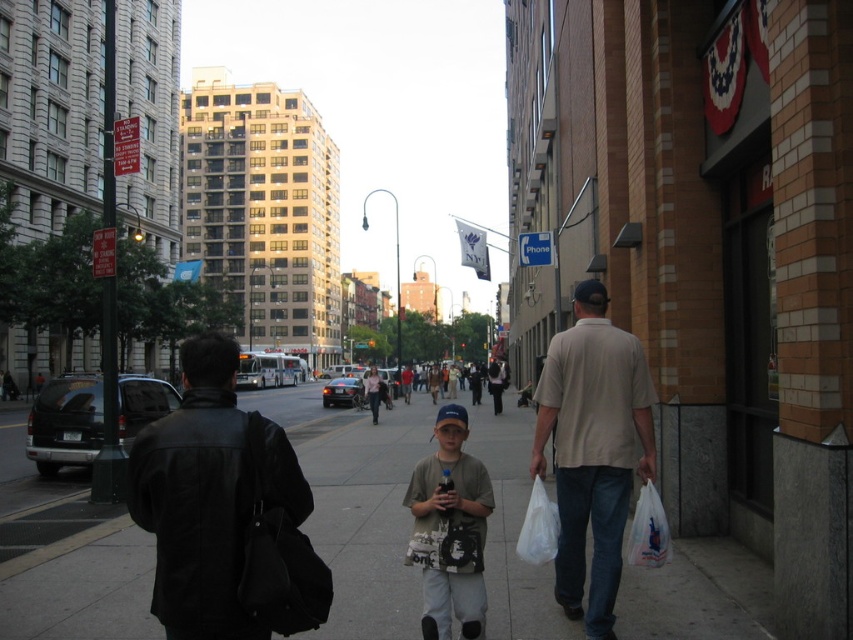
Question: Estimate the real-world distances between objects in this image. Which object is farther from the beige cotton shirt at right?

Choices:
 (A) light gray cotton shirt at center
 (B) smooth concrete sidewalk at center
 (C) black leather jacket at left

Answer: (B)

Question: Among these points, which one is nearest to the camera?

Choices:
 (A) (258, 436)
 (B) (444, 538)
 (C) (627, 467)

Answer: (A)

Question: Does beige cotton shirt at right come behind light gray cotton shirt at center?

Choices:
 (A) yes
 (B) no

Answer: (A)

Question: Is smooth concrete sidewalk at center positioned at the back of beige cotton shirt at right?

Choices:
 (A) yes
 (B) no

Answer: (A)

Question: Among these objects, which one is farthest from the camera?

Choices:
 (A) smooth concrete sidewalk at center
 (B) black leather jacket at left
 (C) light gray cotton shirt at center
 (D) beige cotton shirt at right

Answer: (A)

Question: Does beige cotton shirt at right have a larger size compared to light gray cotton shirt at center?

Choices:
 (A) yes
 (B) no

Answer: (A)